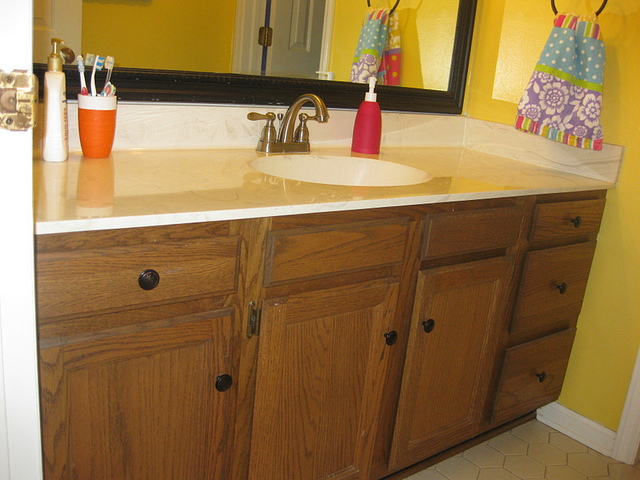
Identify the location of drawer. Image resolution: width=640 pixels, height=480 pixels. (520, 383).